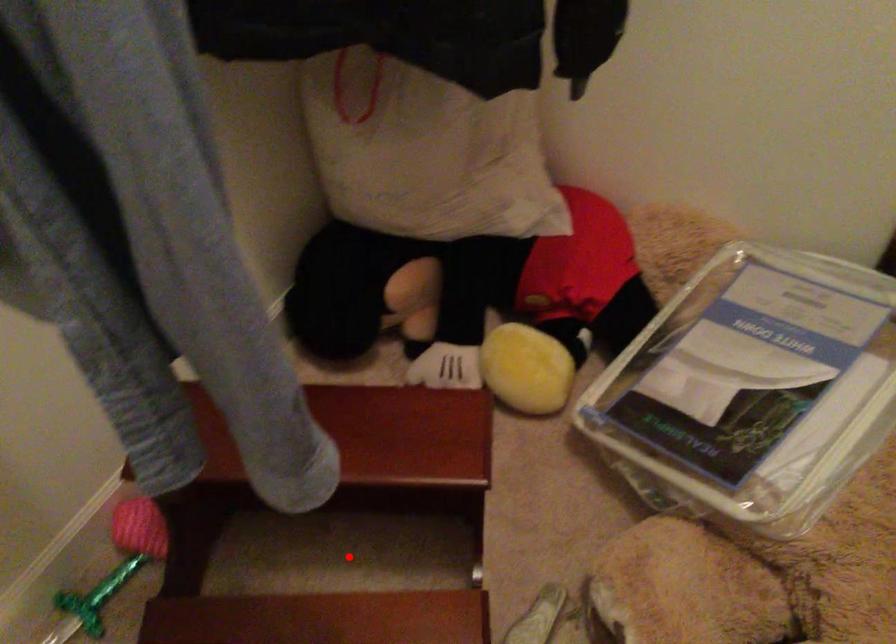
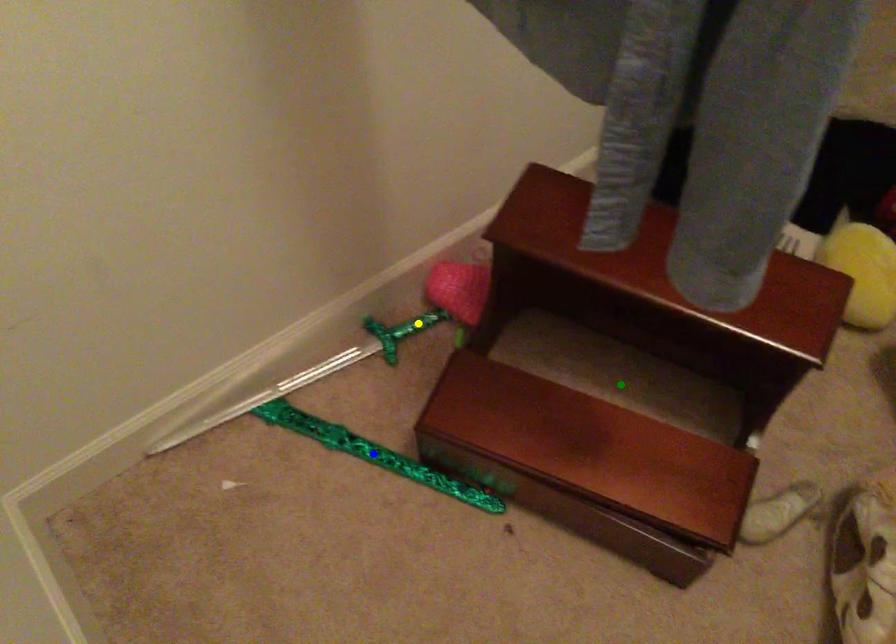
Question: I am providing you with two images of the same scene from different viewpoints. A red point is marked on the first image. You are given multiple points on the second image. Which point in image 2 is actually the same real-world point as the red point in image 1?

Choices:
 (A) green point
 (B) yellow point
 (C) blue point

Answer: (A)